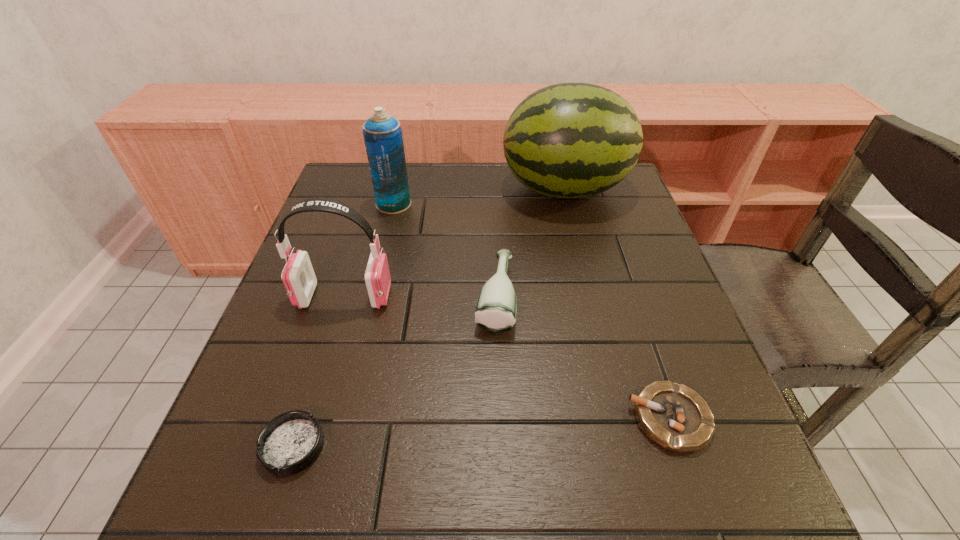
Image resolution: width=960 pixels, height=540 pixels. I want to click on earphone that is at the left edge, so click(298, 277).

Locate an element on the screen. This screenshot has width=960, height=540. ashtray at the left edge is located at coordinates (289, 443).

At what (x,y) coordinates should I click in order to perform the action: click on watermelon that is at the right edge. Please return your answer as a coordinate pair (x, y). Looking at the image, I should click on (572, 140).

The height and width of the screenshot is (540, 960). Identify the location of ashtray at the right edge. (675, 417).

In order to click on object at the far left corner in this screenshot , I will do `click(383, 138)`.

The height and width of the screenshot is (540, 960). I want to click on object present at the near left corner, so click(x=289, y=443).

Where is `object situated at the far right corner`? The width and height of the screenshot is (960, 540). object situated at the far right corner is located at coordinates (572, 140).

Where is `vacant space at the far edge of the desktop`? Image resolution: width=960 pixels, height=540 pixels. vacant space at the far edge of the desktop is located at coordinates (496, 183).

This screenshot has height=540, width=960. Identify the location of blank area at the near edge. (380, 474).

This screenshot has width=960, height=540. Find the location of `vacant space at the left edge`. vacant space at the left edge is located at coordinates (253, 399).